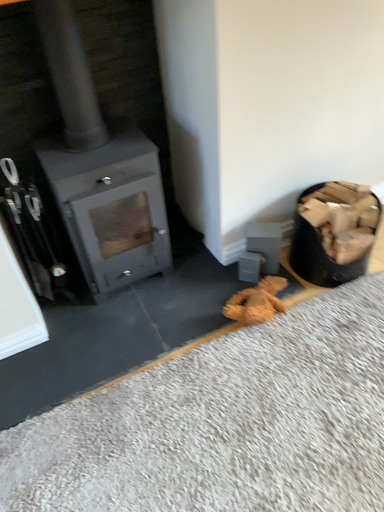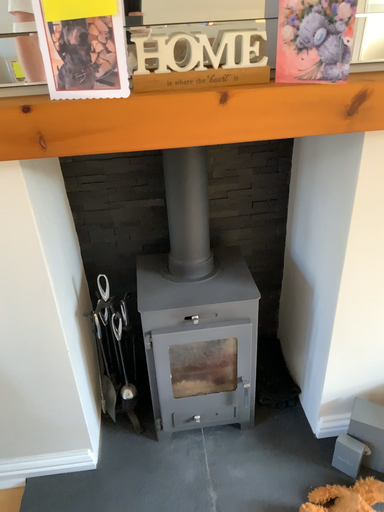
Question: How did the camera likely rotate when shooting the video?

Choices:
 (A) rotated right
 (B) rotated left

Answer: (B)